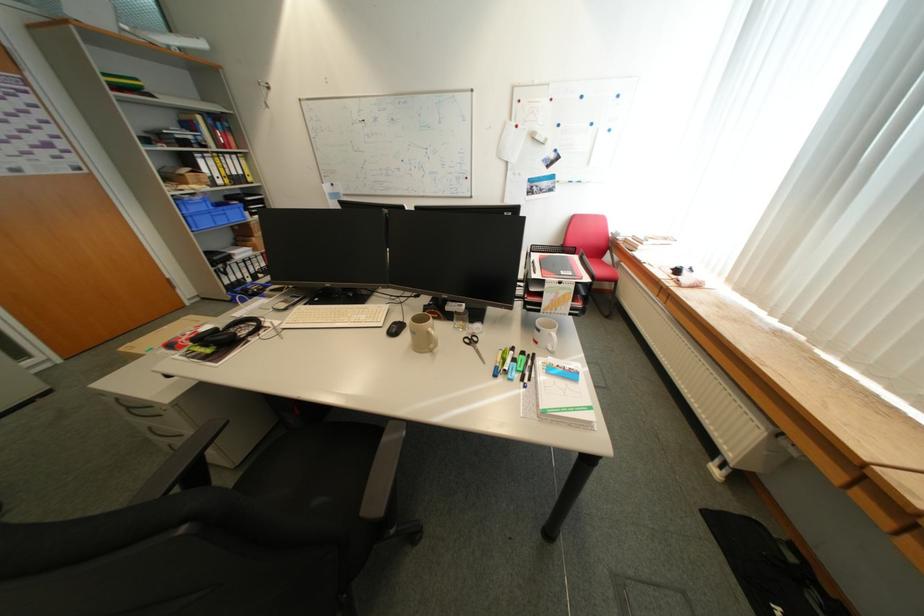
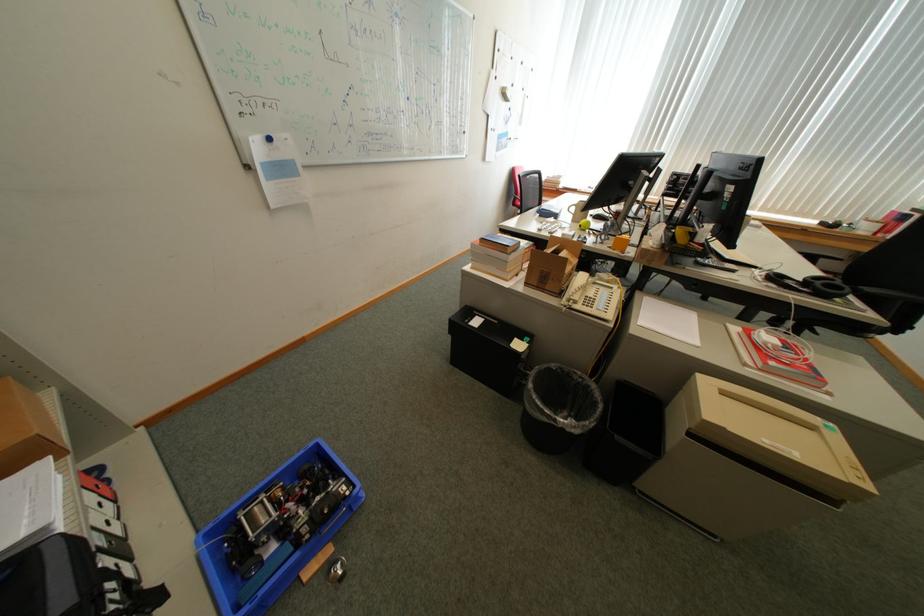
Question: I am providing you with two images of the same scene from different viewpoints. Which of the following objects are not visible in image2?

Choices:
 (A) green apple
 (B) chair sitting surface
 (C) small cardboard box
 (D) black power adapter

Answer: (B)